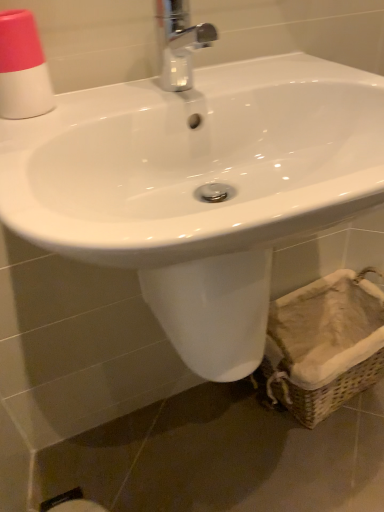
Locate an element on the screen. free space in front of pink matte cup at upper left is located at coordinates (31, 135).